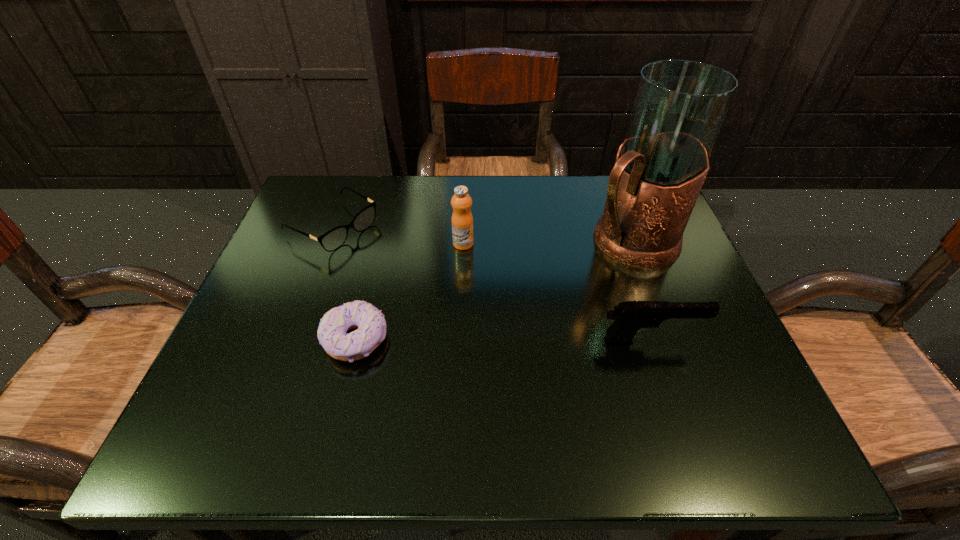
Where is `vacant space at the far right corner`? This screenshot has width=960, height=540. vacant space at the far right corner is located at coordinates (603, 183).

At what (x,y) coordinates should I click in order to perform the action: click on empty space that is in between the doughnut and the third object from left to right. Please return your answer as a coordinate pair (x, y). Looking at the image, I should click on (409, 292).

At what (x,y) coordinates should I click in order to perform the action: click on vacant point located between the spectacles and the doughnut. Please return your answer as a coordinate pair (x, y). This screenshot has height=540, width=960. Looking at the image, I should click on (345, 283).

At what (x,y) coordinates should I click in order to perform the action: click on free spot between the tallest object and the orange juice. Please return your answer as a coordinate pair (x, y). Looking at the image, I should click on (547, 243).

Locate an element on the screen. The width and height of the screenshot is (960, 540). vacant point located between the pitcher and the spectacles is located at coordinates (482, 234).

Where is `free spot between the third shortest object and the spectacles`? The width and height of the screenshot is (960, 540). free spot between the third shortest object and the spectacles is located at coordinates (492, 283).

I want to click on free space between the spectacles and the doughnut, so click(x=345, y=283).

Identify the location of free space between the spectacles and the fourth shortest object. (398, 235).

Identify the location of vacant region between the third tallest object and the orange juice. (557, 292).

The image size is (960, 540). I want to click on free space that is in between the pistol and the orange juice, so click(x=557, y=292).